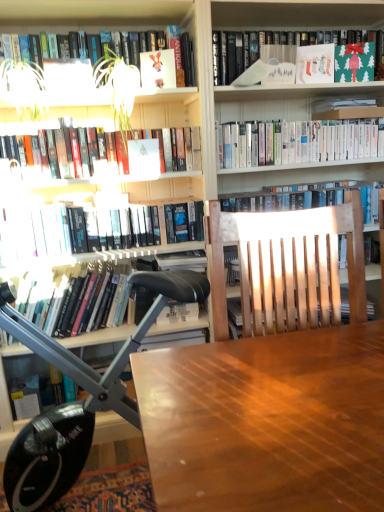
Question: From the image's perspective, is hardcover books at upper left, placed as the fourth book when sorted from bottom to top, under black leather chair at left?

Choices:
 (A) no
 (B) yes

Answer: (A)

Question: Does hardcover books at upper left, arranged as the 4th book when viewed from the top, have a greater height compared to black leather chair at left?

Choices:
 (A) yes
 (B) no

Answer: (B)

Question: Considering the relative positions of hardcover books at upper left, arranged as the 4th book when viewed from the top, and black leather chair at left in the image provided, is hardcover books at upper left, arranged as the 4th book when viewed from the top, behind black leather chair at left?

Choices:
 (A) yes
 (B) no

Answer: (A)

Question: Is hardcover books at upper left, placed as the fourth book when sorted from bottom to top, positioned with its back to black leather chair at left?

Choices:
 (A) yes
 (B) no

Answer: (B)

Question: Can you confirm if hardcover books at upper left, arranged as the 4th book when viewed from the top, is bigger than black leather chair at left?

Choices:
 (A) yes
 (B) no

Answer: (B)

Question: Does hardcover books at upper left, placed as the fourth book when sorted from bottom to top, turn towards black leather chair at left?

Choices:
 (A) no
 (B) yes

Answer: (A)

Question: From the image's perspective, is white glossy bookshelf at upper center, which is the fifth book in bottom-to-top order, below green matte paper at upper right, marked as the 1th paperback book in a right-to-left arrangement?

Choices:
 (A) no
 (B) yes

Answer: (B)

Question: Could green matte paper at upper right, which is the 4th paperback book from left to right, be considered to be inside white glossy bookshelf at upper center, which is the fifth book in bottom-to-top order?

Choices:
 (A) no
 (B) yes

Answer: (A)

Question: Is white glossy bookshelf at upper center, which is the fifth book in bottom-to-top order, positioned with its back to green matte paper at upper right, marked as the 1th paperback book in a right-to-left arrangement?

Choices:
 (A) yes
 (B) no

Answer: (B)

Question: Would you consider white glossy bookshelf at upper center, the 3th book viewed from the top, to be distant from green matte paper at upper right, which is the 4th paperback book from left to right?

Choices:
 (A) yes
 (B) no

Answer: (B)

Question: From a real-world perspective, is white glossy bookshelf at upper center, which is the fifth book in bottom-to-top order, positioned over green matte paper at upper right, marked as the 1th paperback book in a right-to-left arrangement, based on gravity?

Choices:
 (A) yes
 (B) no

Answer: (B)

Question: Is the depth of white glossy bookshelf at upper center, which is the fifth book in bottom-to-top order, greater than that of green matte paper at upper right, which is the 4th paperback book from left to right?

Choices:
 (A) no
 (B) yes

Answer: (A)

Question: Considering the relative sizes of green leafy plant at upper left and black leather chair at left in the image provided, is green leafy plant at upper left thinner than black leather chair at left?

Choices:
 (A) no
 (B) yes

Answer: (B)